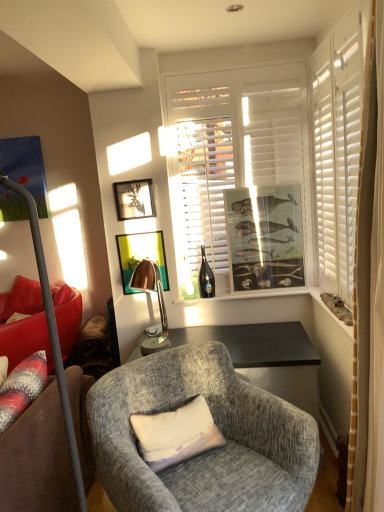
Question: Is pastel fabric pillow at center outside of matte glass window sill at center, the first window sill viewed from the left?

Choices:
 (A) no
 (B) yes

Answer: (B)

Question: Is pastel fabric pillow at center looking in the opposite direction of matte glass window sill at center, the first window sill viewed from the left?

Choices:
 (A) no
 (B) yes

Answer: (A)

Question: Does pastel fabric pillow at center have a greater width compared to matte glass window sill at center, the 2th window sill from the right?

Choices:
 (A) yes
 (B) no

Answer: (A)

Question: Is pastel fabric pillow at center to the left of matte glass window sill at center, which ranks as the first window sill in back-to-front order, from the viewer's perspective?

Choices:
 (A) no
 (B) yes

Answer: (B)

Question: Is pastel fabric pillow at center positioned behind matte glass window sill at center, the first window sill viewed from the left?

Choices:
 (A) yes
 (B) no

Answer: (B)

Question: In the image, is white textured stone at right, acting as the 1th window sill starting from the right, on the left side or the right side of matte glass window sill at center, which ranks as the first window sill in back-to-front order?

Choices:
 (A) left
 (B) right

Answer: (B)

Question: In terms of width, does white textured stone at right, acting as the 1th window sill starting from the right, look wider or thinner when compared to matte glass window sill at center, marked as the second window sill in a front-to-back arrangement?

Choices:
 (A) wide
 (B) thin

Answer: (B)

Question: From a real-world perspective, is white textured stone at right, the second window sill when ordered from back to front, physically located above or below matte glass window sill at center, marked as the second window sill in a front-to-back arrangement?

Choices:
 (A) above
 (B) below

Answer: (A)

Question: Relative to matte glass window sill at center, which ranks as the first window sill in back-to-front order, is white textured stone at right, which is counted as the 2th window sill, starting from the left, in front or behind?

Choices:
 (A) behind
 (B) front

Answer: (B)

Question: From a real-world perspective, is metallic silver lamp at left, the second lamp when ordered from right to left, positioned above or below matte wooden picture frame at center, which ranks as the third picture frame in left-to-right order?

Choices:
 (A) above
 (B) below

Answer: (B)

Question: Based on their sizes in the image, would you say metallic silver lamp at left, which ranks as the first lamp in left-to-right order, is bigger or smaller than matte wooden picture frame at center, which ranks as the third picture frame in left-to-right order?

Choices:
 (A) big
 (B) small

Answer: (A)

Question: Considering the positions of metallic silver lamp at left, arranged as the second lamp when viewed from the back, and matte wooden picture frame at center, which ranks as the third picture frame in left-to-right order, in the image, is metallic silver lamp at left, arranged as the second lamp when viewed from the back, wider or thinner than matte wooden picture frame at center, which ranks as the third picture frame in left-to-right order,?

Choices:
 (A) wide
 (B) thin

Answer: (A)

Question: From the image's perspective, is metallic silver lamp at left, arranged as the second lamp when viewed from the back, positioned above or below matte wooden picture frame at center, the first picture frame in the right-to-left sequence?

Choices:
 (A) above
 (B) below

Answer: (B)

Question: Visually, is pastel fabric pillow at center positioned to the left or to the right of matte wooden picture frame at center, the first picture frame in the right-to-left sequence?

Choices:
 (A) right
 (B) left

Answer: (B)

Question: In terms of width, does pastel fabric pillow at center look wider or thinner when compared to matte wooden picture frame at center, which ranks as the third picture frame in left-to-right order?

Choices:
 (A) thin
 (B) wide

Answer: (B)